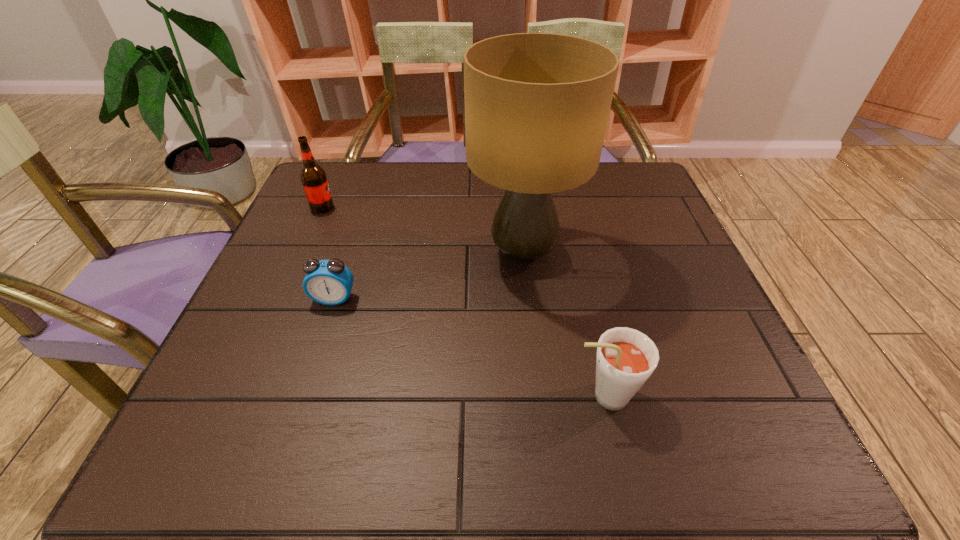
The image size is (960, 540). Identify the location of free space located on the drink side of the shorter root beer. (492, 396).

Find the location of a particular element. The image size is (960, 540). free space located 0.290m on the drink side of the shorter root beer is located at coordinates (399, 396).

Locate an element on the screen. The width and height of the screenshot is (960, 540). vacant area situated on the face of the third object from right to left is located at coordinates (305, 387).

Identify the location of object situated at the far edge. This screenshot has height=540, width=960. (313, 177).

At what (x,y) coordinates should I click in order to perform the action: click on object present at the near edge. Please return your answer as a coordinate pair (x, y). Looking at the image, I should click on (625, 359).

Where is `root beer that is at the left edge`? root beer that is at the left edge is located at coordinates (313, 177).

Identify the location of alarm clock present at the left edge. The height and width of the screenshot is (540, 960). (329, 282).

This screenshot has width=960, height=540. I want to click on object present at the far left corner, so click(313, 177).

Find the location of a particular element. Image resolution: width=960 pixels, height=540 pixels. vacant space at the far edge is located at coordinates (444, 178).

This screenshot has height=540, width=960. What are the coordinates of `vacant space at the near edge` in the screenshot? It's located at (570, 431).